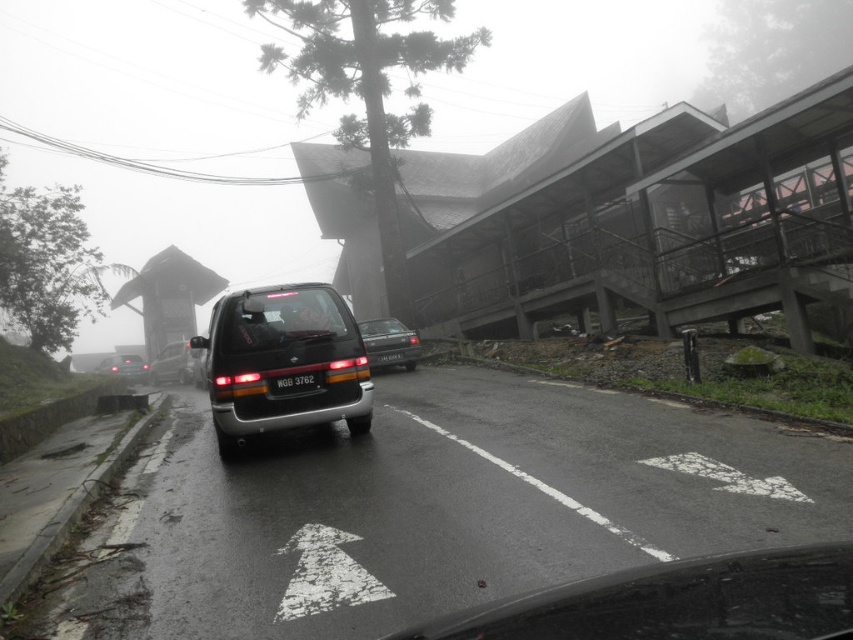
Is satin silver van at center shorter than black matte license plate at center?

Incorrect, satin silver van at center's height does not fall short of black matte license plate at center's.

Can you confirm if satin silver van at center is thinner than black matte license plate at center?

In fact, satin silver van at center might be wider than black matte license plate at center.

Locate an element on the screen. Image resolution: width=853 pixels, height=640 pixels. satin silver van at center is located at coordinates (173, 364).

Is satin silver sedan at center thinner than matte black van at left?

Yes, satin silver sedan at center is thinner than matte black van at left.

The height and width of the screenshot is (640, 853). What do you see at coordinates (389, 342) in the screenshot?
I see `satin silver sedan at center` at bounding box center [389, 342].

Find the location of a particular element. The height and width of the screenshot is (640, 853). satin silver sedan at center is located at coordinates (389, 342).

Consider the image. Does satin silver sedan at center appear on the right side of black matte license plate at center?

Yes, satin silver sedan at center is to the right of black matte license plate at center.

Does point (367, 339) come behind point (276, 381)?

Yes, it is.

This screenshot has width=853, height=640. Find the location of `satin silver sedan at center`. satin silver sedan at center is located at coordinates [x=389, y=342].